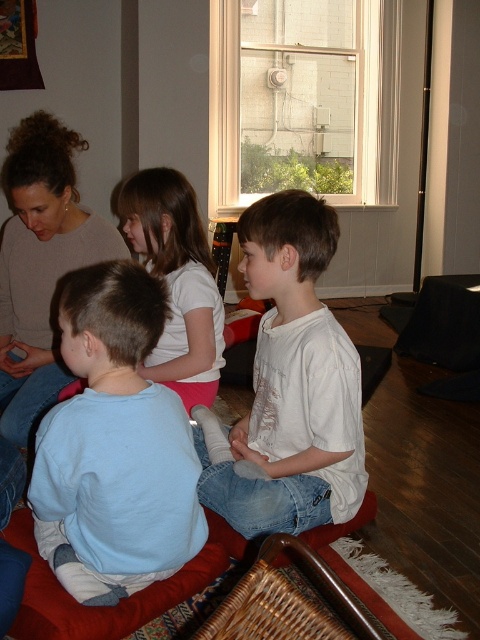
Consider the image. How distant is matte beige sweater at upper left from white matte shirt at center?

matte beige sweater at upper left is 14.12 inches away from white matte shirt at center.

Does point (31, 164) come in front of point (196, 362)?

Yes, point (31, 164) is closer to viewer.

Where is `matte beige sweater at upper left`? This screenshot has width=480, height=640. matte beige sweater at upper left is located at coordinates (x=38, y=276).

Can you confirm if light blue cotton shirt at lower left is positioned above white cotton shirt at center?

Incorrect, light blue cotton shirt at lower left is not positioned above white cotton shirt at center.

Between light blue cotton shirt at lower left and white cotton shirt at center, which one has less height?

light blue cotton shirt at lower left

Measure the distance between light blue cotton shirt at lower left and camera.

1.34 meters

This screenshot has height=640, width=480. What are the coordinates of `light blue cotton shirt at lower left` in the screenshot? It's located at (115, 445).

Can you confirm if light blue cotton shirt at lower left is positioned above matte beige sweater at upper left?

Actually, light blue cotton shirt at lower left is below matte beige sweater at upper left.

Does light blue cotton shirt at lower left have a lesser width compared to matte beige sweater at upper left?

Yes, light blue cotton shirt at lower left is thinner than matte beige sweater at upper left.

Which is behind, point (126, 321) or point (1, 376)?

The point (1, 376) is more distant.

Locate an element on the screen. light blue cotton shirt at lower left is located at coordinates (115, 445).